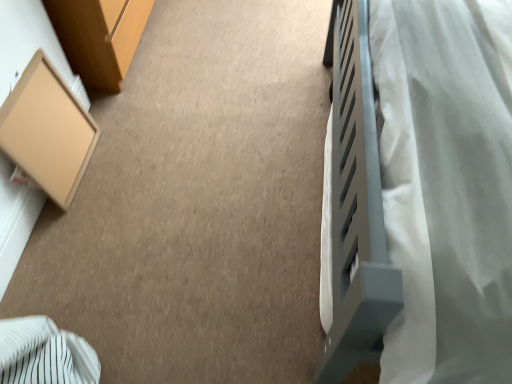
Question: Should I look upward or downward to see white soft fabric at right?

Choices:
 (A) down
 (B) up

Answer: (B)

Question: Should I look upward or downward to see matte cardboard box at left?

Choices:
 (A) down
 (B) up

Answer: (B)

Question: From the image's perspective, is white soft fabric at right located beneath matte cardboard box at left?

Choices:
 (A) yes
 (B) no

Answer: (B)

Question: Is white soft fabric at right positioned in front of matte cardboard box at left?

Choices:
 (A) no
 (B) yes

Answer: (B)

Question: Considering the relative sizes of white soft fabric at right and matte cardboard box at left in the image provided, is white soft fabric at right taller than matte cardboard box at left?

Choices:
 (A) no
 (B) yes

Answer: (B)

Question: Does white soft fabric at right have a lesser height compared to matte cardboard box at left?

Choices:
 (A) no
 (B) yes

Answer: (A)

Question: Does white soft fabric at right turn towards matte cardboard box at left?

Choices:
 (A) no
 (B) yes

Answer: (B)

Question: Is white soft fabric at right positioned with its back to matte cardboard box at left?

Choices:
 (A) no
 (B) yes

Answer: (A)

Question: Can you confirm if matte cardboard box at left is shorter than white soft fabric at right?

Choices:
 (A) no
 (B) yes

Answer: (B)

Question: Does matte cardboard box at left appear on the left side of white soft fabric at right?

Choices:
 (A) no
 (B) yes

Answer: (B)

Question: From the image's perspective, is matte cardboard box at left on white soft fabric at right?

Choices:
 (A) yes
 (B) no

Answer: (B)

Question: Can you confirm if matte cardboard box at left is bigger than white soft fabric at right?

Choices:
 (A) yes
 (B) no

Answer: (B)

Question: Can you confirm if matte cardboard box at left is smaller than white soft fabric at right?

Choices:
 (A) no
 (B) yes

Answer: (B)

Question: Is matte cardboard box at left positioned before white soft fabric at right?

Choices:
 (A) yes
 (B) no

Answer: (B)

Question: From the image's perspective, relative to white soft fabric at right, is matte cardboard box at left above or below?

Choices:
 (A) below
 (B) above

Answer: (A)